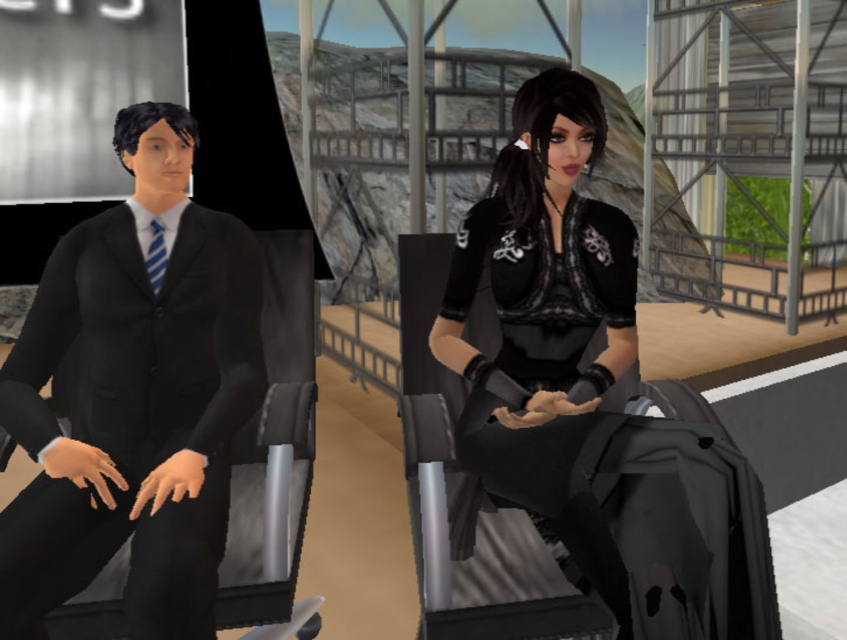
You are a photographer setting up a shoot in this futuristic industrial scene. You need to position a spotlight that can illuminate both the matte black suit at left and the black lace dress at center. Based on their positions, which object should you place the spotlight closer to to ensure both are equally lit?

The spotlight should be placed closer to the black lace dress at center because the matte black suit at left is located above it, meaning the dress is lower and might require more direct lighting to balance the illumination.

You are a photographer setting up a shoot in this futuristic scene. You need to position a spotlight that can reach both the matte black suit at left and the black lace dress at center. Since the spotlight can only illuminate objects up to its height, which object should determine the minimum height you set the spotlight to?

The spotlight must be set to at least the height of the taller object. Since the matte black suit at left is taller than the black lace dress at center, the minimum height should be based on the matte black suit at left to ensure both are illuminated.